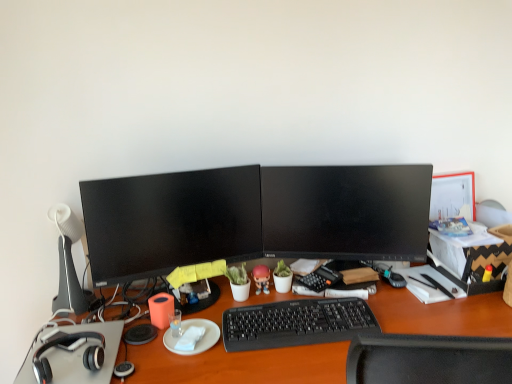
Where is `free spot above black plastic keyboard at center (from a real-world perspective)`? free spot above black plastic keyboard at center (from a real-world perspective) is located at coordinates (300, 317).